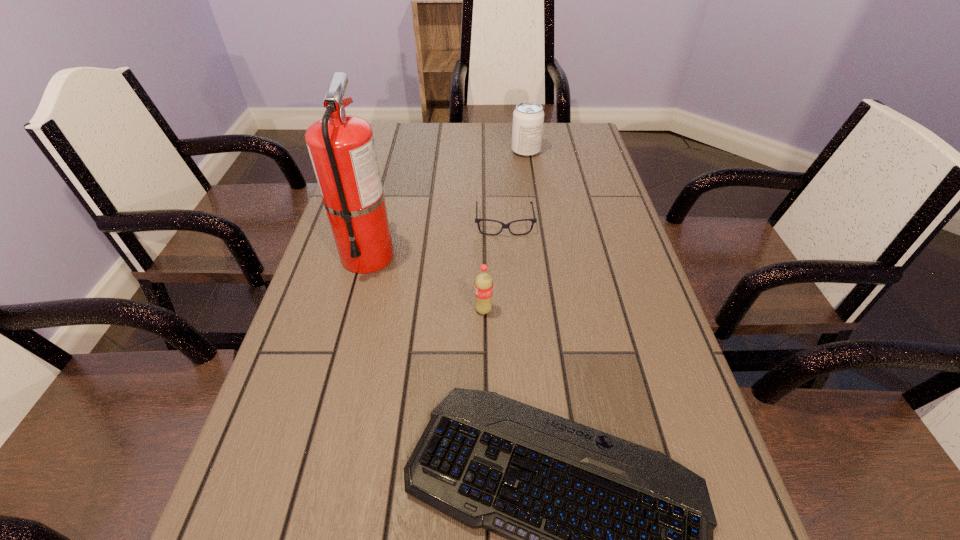
The image size is (960, 540). I want to click on free space located 0.340m on the front-facing side of the spectacles, so click(x=513, y=350).

Where is `object that is positioned at the far edge`? The width and height of the screenshot is (960, 540). object that is positioned at the far edge is located at coordinates coord(528,117).

At what (x,y) coordinates should I click in order to perform the action: click on object situated at the left edge. Please return your answer as a coordinate pair (x, y). Looking at the image, I should click on (342, 149).

Locate an element on the screen. This screenshot has height=540, width=960. vacant area at the far edge of the desktop is located at coordinates (499, 158).

Identify the location of vacant space at the left edge. (348, 279).

Image resolution: width=960 pixels, height=540 pixels. What are the coordinates of `free space at the right edge of the desktop` in the screenshot? It's located at (572, 178).

Image resolution: width=960 pixels, height=540 pixels. In order to click on vacant space at the far left corner in this screenshot , I will do `click(416, 134)`.

In order to click on free spot between the leftmost object and the spectacles in this screenshot , I will do `click(436, 239)`.

The width and height of the screenshot is (960, 540). What are the coordinates of `empty space that is in between the nearer soda and the fire extinguisher` in the screenshot? It's located at (425, 282).

Find the location of a particular element. vacant area that lies between the tallest object and the second nearest object is located at coordinates [425, 282].